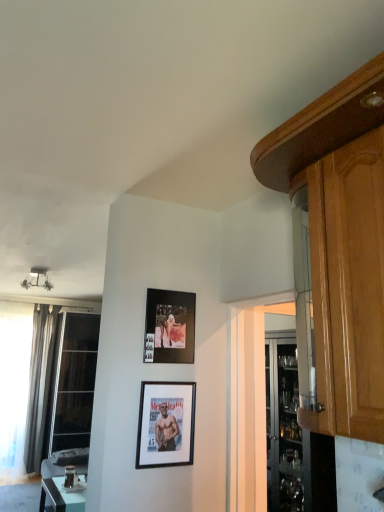
Question: Would you say silky gray curtain at left contains black matte picture frame at center, positioned as the second picture frame in top-to-bottom order?

Choices:
 (A) no
 (B) yes

Answer: (A)

Question: From a real-world perspective, is silky gray curtain at left below black matte picture frame at center, which ranks as the 1th picture frame in bottom-to-top order?

Choices:
 (A) no
 (B) yes

Answer: (B)

Question: Considering the relative sizes of silky gray curtain at left and black matte picture frame at center, positioned as the second picture frame in top-to-bottom order, in the image provided, is silky gray curtain at left bigger than black matte picture frame at center, positioned as the second picture frame in top-to-bottom order,?

Choices:
 (A) yes
 (B) no

Answer: (A)

Question: Would you say silky gray curtain at left is a long distance from black matte picture frame at center, which ranks as the 1th picture frame in bottom-to-top order?

Choices:
 (A) no
 (B) yes

Answer: (B)

Question: Considering the relative positions of silky gray curtain at left and black matte picture frame at center, which ranks as the 1th picture frame in bottom-to-top order, in the image provided, is silky gray curtain at left behind black matte picture frame at center, which ranks as the 1th picture frame in bottom-to-top order,?

Choices:
 (A) no
 (B) yes

Answer: (B)

Question: Does point (67, 501) appear closer or farther from the camera than point (84, 409)?

Choices:
 (A) closer
 (B) farther

Answer: (A)

Question: Is white glossy table at lower left inside the boundaries of transparent glass window at left, the 1th window from the right, or outside?

Choices:
 (A) inside
 (B) outside

Answer: (B)

Question: From a real-world perspective, relative to transparent glass window at left, which ranks as the 2th window in left-to-right order, is white glossy table at lower left vertically above or below?

Choices:
 (A) below
 (B) above

Answer: (A)

Question: Relative to transparent glass window at left, which ranks as the 2th window in left-to-right order, is white glossy table at lower left in front or behind?

Choices:
 (A) front
 (B) behind

Answer: (A)

Question: Is glossy wood cabinet at upper right spatially inside matte black photo frame at upper center, the 1th picture frame from the top, or outside of it?

Choices:
 (A) inside
 (B) outside

Answer: (B)

Question: Relative to matte black photo frame at upper center, the 1th picture frame from the top, is glossy wood cabinet at upper right in front or behind?

Choices:
 (A) front
 (B) behind

Answer: (A)

Question: Considering the positions of glossy wood cabinet at upper right and matte black photo frame at upper center, the 1th picture frame from the top, in the image, is glossy wood cabinet at upper right wider or thinner than matte black photo frame at upper center, the 1th picture frame from the top,?

Choices:
 (A) wide
 (B) thin

Answer: (A)

Question: From a real-world perspective, is glossy wood cabinet at upper right positioned above or below matte black photo frame at upper center, positioned as the 2th picture frame in bottom-to-top order?

Choices:
 (A) below
 (B) above

Answer: (B)

Question: Is silky gray curtain at left in front of or behind matte black photo frame at upper center, the 1th picture frame from the top, in the image?

Choices:
 (A) behind
 (B) front

Answer: (A)

Question: Is silky gray curtain at left inside or outside of matte black photo frame at upper center, the 1th picture frame from the top?

Choices:
 (A) inside
 (B) outside

Answer: (B)